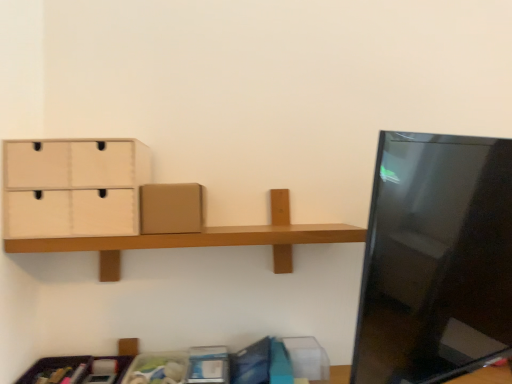
Question: Can you confirm if beige cardboard drawer at upper left is taller than brown cardboard box at center?

Choices:
 (A) no
 (B) yes

Answer: (B)

Question: Does beige cardboard drawer at upper left have a lesser width compared to brown cardboard box at center?

Choices:
 (A) yes
 (B) no

Answer: (A)

Question: Considering the relative positions of beige cardboard drawer at upper left and brown cardboard box at center in the image provided, is beige cardboard drawer at upper left to the right of brown cardboard box at center from the viewer's perspective?

Choices:
 (A) no
 (B) yes

Answer: (A)

Question: Is beige cardboard drawer at upper left in contact with brown cardboard box at center?

Choices:
 (A) no
 (B) yes

Answer: (A)

Question: Considering the relative sizes of beige cardboard drawer at upper left and brown cardboard box at center in the image provided, is beige cardboard drawer at upper left shorter than brown cardboard box at center?

Choices:
 (A) yes
 (B) no

Answer: (B)

Question: Is beige cardboard drawer at upper left at the left side of brown cardboard box at center?

Choices:
 (A) no
 (B) yes

Answer: (B)

Question: Does brown cardboard box at center have a greater width compared to beige cardboard drawer at upper left?

Choices:
 (A) no
 (B) yes

Answer: (B)

Question: Considering the relative sizes of brown cardboard box at center and beige cardboard drawer at upper left in the image provided, is brown cardboard box at center bigger than beige cardboard drawer at upper left?

Choices:
 (A) no
 (B) yes

Answer: (A)

Question: Is brown cardboard box at center facing towards beige cardboard drawer at upper left?

Choices:
 (A) no
 (B) yes

Answer: (A)

Question: Is brown cardboard box at center turned away from beige cardboard drawer at upper left?

Choices:
 (A) yes
 (B) no

Answer: (B)

Question: Is brown cardboard box at center to the left of beige cardboard drawer at upper left from the viewer's perspective?

Choices:
 (A) no
 (B) yes

Answer: (A)

Question: Is brown cardboard box at center far away from beige cardboard drawer at upper left?

Choices:
 (A) yes
 (B) no

Answer: (B)

Question: Considering the positions of brown cardboard box at center and beige cardboard drawer at upper left in the image, is brown cardboard box at center taller or shorter than beige cardboard drawer at upper left?

Choices:
 (A) short
 (B) tall

Answer: (A)